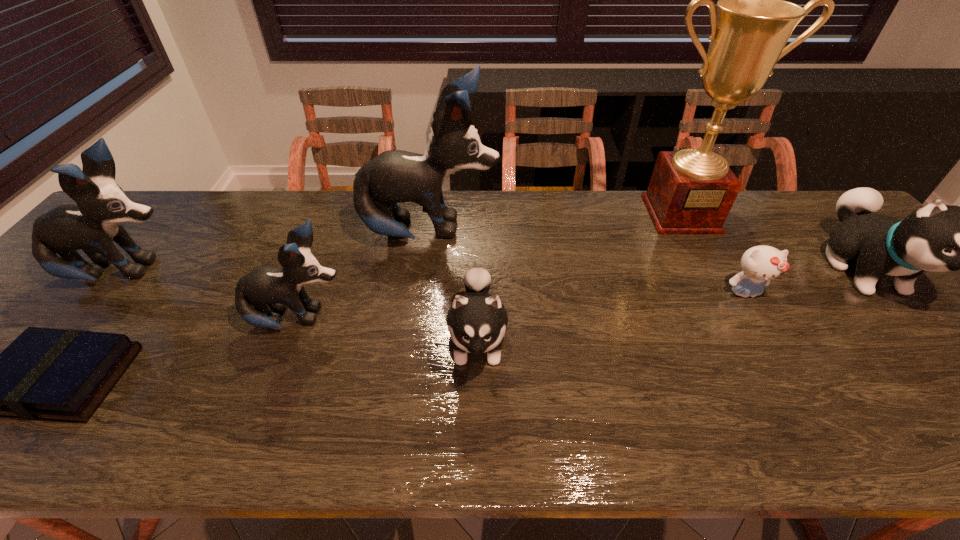
Find the location of `the seventh tallest object`. the seventh tallest object is located at coordinates (760, 264).

Where is `free space located 0.390m on the plaque of the trophy cup`? The width and height of the screenshot is (960, 540). free space located 0.390m on the plaque of the trophy cup is located at coordinates (749, 343).

The image size is (960, 540). I want to click on free point located on the front-facing side of the biggest black puppy, so click(x=518, y=233).

Locate an element on the screen. This screenshot has width=960, height=540. free space located on the front-facing side of the second farthest black puppy is located at coordinates (335, 273).

Image resolution: width=960 pixels, height=540 pixels. I want to click on vacant space located 0.130m at the face of the bigger white puppy, so click(x=950, y=369).

Locate an element on the screen. free point located on the front-facing side of the smallest black puppy is located at coordinates point(402,320).

You are a GUI agent. You are given a task and a screenshot of the screen. Output one action in this format:
    pyautogui.click(x=<x>, y=<y>)
    Task: Click on the vacant area situated 0.090m at the face of the shortest puppy
    The image size is (960, 540).
    Given the screenshot: What is the action you would take?
    pyautogui.click(x=477, y=433)

Find the location of a particular element. The height and width of the screenshot is (540, 960). vacant point located on the front-facing side of the kitten is located at coordinates (780, 353).

Identify the location of trophy cup that is at the far edge. [x=691, y=191].

Where is `object located at the left edge`? This screenshot has width=960, height=540. object located at the left edge is located at coordinates (92, 225).